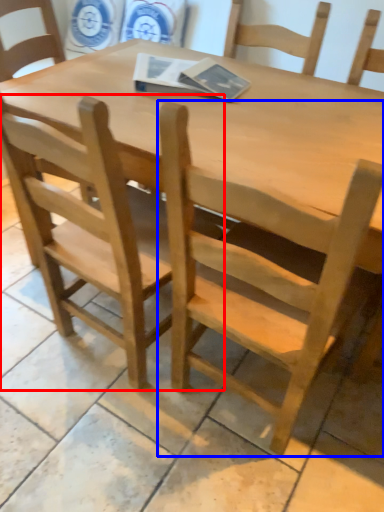
Question: Which of the following is the farthest to the observer, chair (highlighted by a red box) or chair (highlighted by a blue box)?

Choices:
 (A) chair
 (B) chair

Answer: (A)